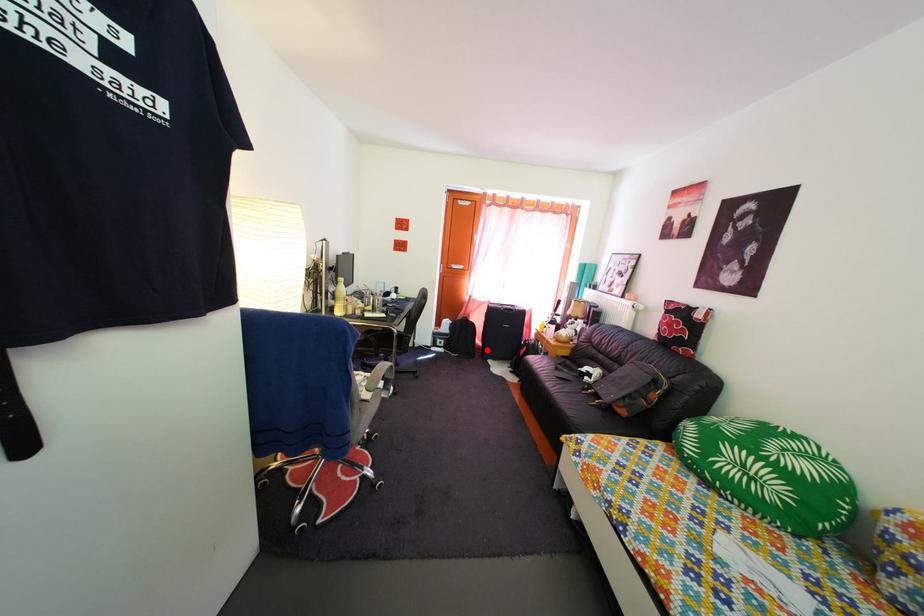
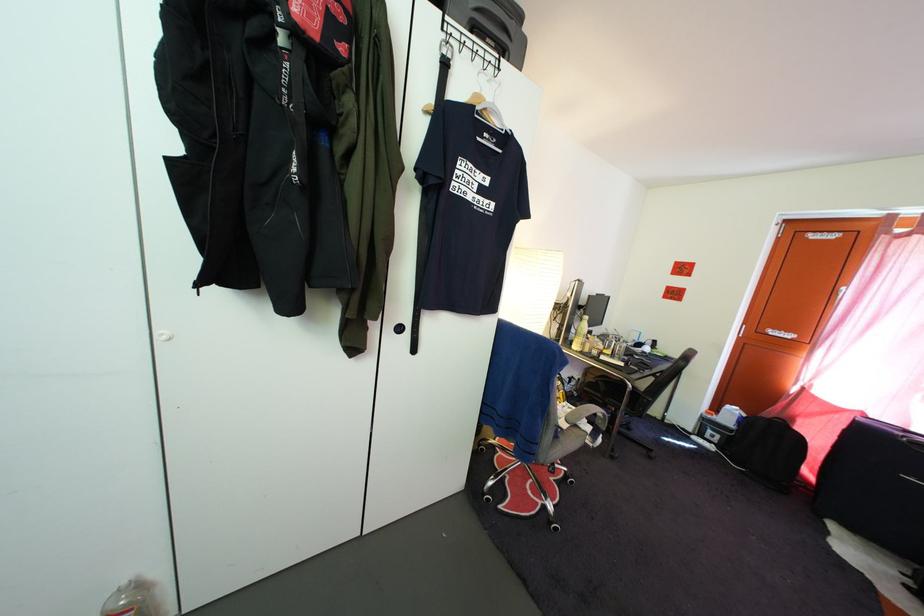
The point at the highlighted location is marked in the first image. Where is the corresponding point in the second image?

(817, 483)